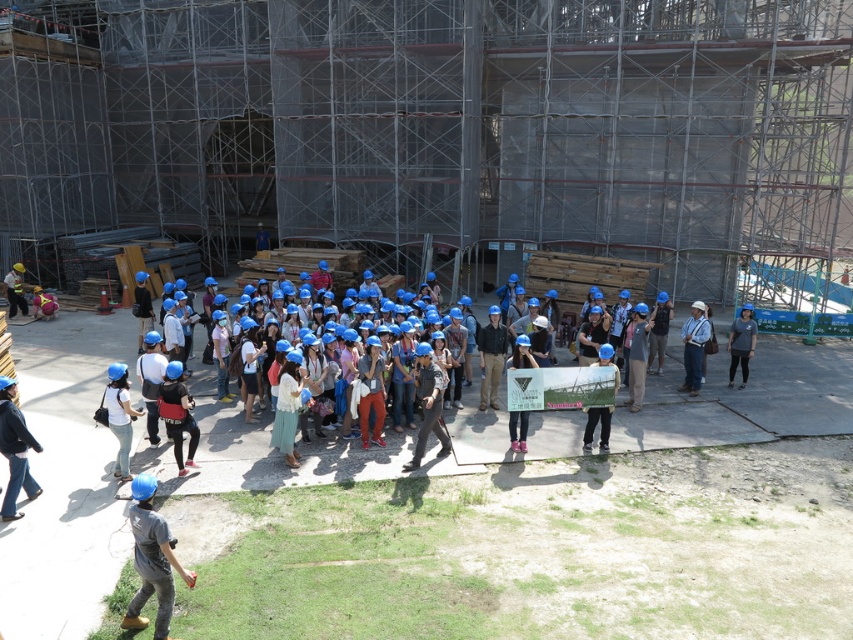
Question: Which of the following is the closest to the observer?

Choices:
 (A) (165, 573)
 (B) (20, 305)
 (C) (120, 480)

Answer: (A)

Question: Among these points, which one is farthest from the camera?

Choices:
 (A) (698, 330)
 (B) (426, 557)
 (C) (134, 561)
 (D) (9, 312)

Answer: (D)

Question: Does blue hard hats at center come in front of gray matte shirt at right?

Choices:
 (A) no
 (B) yes

Answer: (B)

Question: Is gray matte shirt at right to the left of matte yellow safety vest at left from the viewer's perspective?

Choices:
 (A) no
 (B) yes

Answer: (A)

Question: Is matte blue helmet at lower center closer to camera compared to white fabric at center?

Choices:
 (A) no
 (B) yes

Answer: (B)

Question: Among these points, which one is nearest to the camera?

Choices:
 (A) (20, 288)
 (B) (743, 355)

Answer: (B)